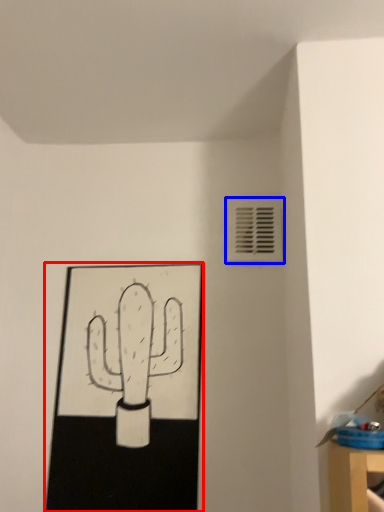
Question: Among these objects, which one is nearest to the camera, picture frame (highlighted by a red box) or air conditioning (highlighted by a blue box)?

Choices:
 (A) picture frame
 (B) air conditioning

Answer: (A)